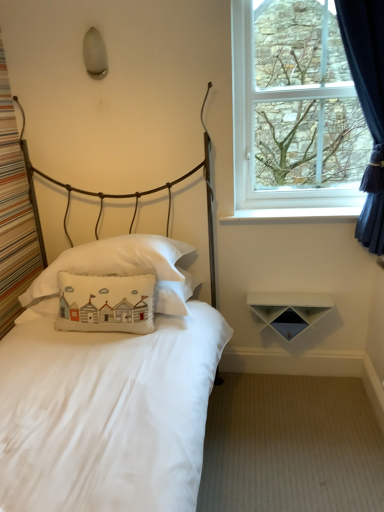
Question: From a real-world perspective, does white cotton pillow at center, acting as the 3th pillow starting from the top, sit lower than white cotton pillow at center, which ranks as the second pillow in bottom-to-top order?

Choices:
 (A) yes
 (B) no

Answer: (B)

Question: Is white cotton pillow at center, placed as the 1th pillow when sorted from bottom to top, wider than white cotton pillow at center, the second pillow when ordered from top to bottom?

Choices:
 (A) yes
 (B) no

Answer: (B)

Question: Is white cotton pillow at center, the second pillow when ordered from top to bottom, inside white cotton pillow at center, acting as the 3th pillow starting from the top?

Choices:
 (A) yes
 (B) no

Answer: (B)

Question: From a real-world perspective, is white cotton pillow at center, placed as the 1th pillow when sorted from bottom to top, over white cotton pillow at center, which ranks as the second pillow in bottom-to-top order?

Choices:
 (A) yes
 (B) no

Answer: (A)

Question: Is white cotton pillow at center, placed as the 1th pillow when sorted from bottom to top, oriented towards white cotton pillow at center, the second pillow when ordered from top to bottom?

Choices:
 (A) no
 (B) yes

Answer: (B)

Question: Considering the relative sizes of white cotton pillow at center, placed as the 1th pillow when sorted from bottom to top, and white cotton pillow at center, which ranks as the second pillow in bottom-to-top order, in the image provided, is white cotton pillow at center, placed as the 1th pillow when sorted from bottom to top, thinner than white cotton pillow at center, which ranks as the second pillow in bottom-to-top order,?

Choices:
 (A) no
 (B) yes

Answer: (B)

Question: Could you tell me if clear glass window at upper right is turned towards white matte shelf at lower right?

Choices:
 (A) no
 (B) yes

Answer: (A)

Question: From a real-world perspective, is clear glass window at upper right under white matte shelf at lower right?

Choices:
 (A) yes
 (B) no

Answer: (B)

Question: Is the surface of clear glass window at upper right in direct contact with white matte shelf at lower right?

Choices:
 (A) yes
 (B) no

Answer: (B)

Question: Can you confirm if clear glass window at upper right is smaller than white matte shelf at lower right?

Choices:
 (A) yes
 (B) no

Answer: (B)

Question: Does clear glass window at upper right come behind white matte shelf at lower right?

Choices:
 (A) yes
 (B) no

Answer: (B)

Question: Considering the relative positions of clear glass window at upper right and white matte shelf at lower right in the image provided, is clear glass window at upper right to the left of white matte shelf at lower right from the viewer's perspective?

Choices:
 (A) no
 (B) yes

Answer: (A)

Question: From a real-world perspective, is white matte shelf at lower right over white cotton pillow at center, which ranks as the second pillow in bottom-to-top order?

Choices:
 (A) no
 (B) yes

Answer: (A)